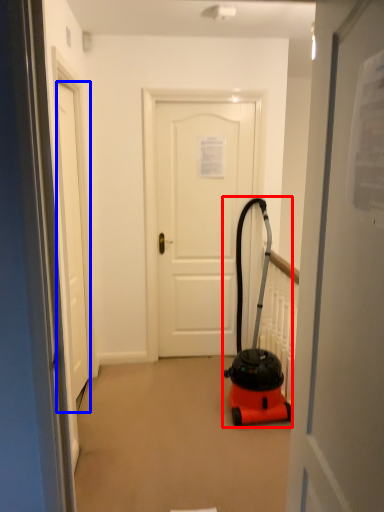
Question: Which of the following is the farthest to the observer, equipment (highlighted by a red box) or door (highlighted by a blue box)?

Choices:
 (A) equipment
 (B) door

Answer: (A)